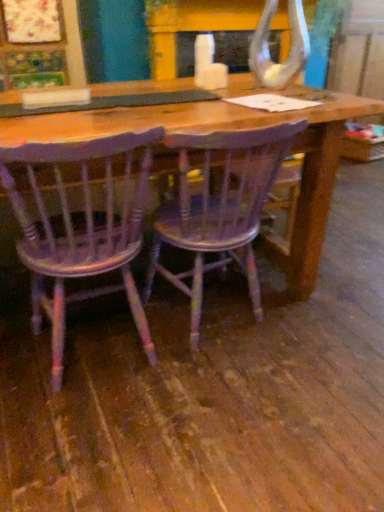
Question: In terms of height, does distressed purple wood chair at center, acting as the first chair starting from the left, look taller or shorter compared to wooden chair at center, the 1th chair when ordered from right to left?

Choices:
 (A) tall
 (B) short

Answer: (A)

Question: Based on their sizes in the image, would you say distressed purple wood chair at center, acting as the first chair starting from the left, is bigger or smaller than wooden chair at center, the 1th chair when ordered from right to left?

Choices:
 (A) small
 (B) big

Answer: (A)

Question: Considering the positions of point (134, 233) and point (205, 215), is point (134, 233) closer or farther from the camera than point (205, 215)?

Choices:
 (A) farther
 (B) closer

Answer: (B)

Question: Is wooden chair at center, the second chair from the left, in front of or behind distressed purple wood chair at center, acting as the first chair starting from the left, in the image?

Choices:
 (A) behind
 (B) front

Answer: (A)

Question: Considering the positions of point (221, 262) and point (94, 233), is point (221, 262) closer or farther from the camera than point (94, 233)?

Choices:
 (A) closer
 (B) farther

Answer: (B)

Question: Is wooden chair at center, the second chair from the left, wider or thinner than distressed purple wood chair at center, positioned as the 2th chair in right-to-left order?

Choices:
 (A) thin
 (B) wide

Answer: (B)

Question: Is wooden chair at center, the 1th chair when ordered from right to left, spatially inside distressed purple wood chair at center, acting as the first chair starting from the left, or outside of it?

Choices:
 (A) outside
 (B) inside

Answer: (A)